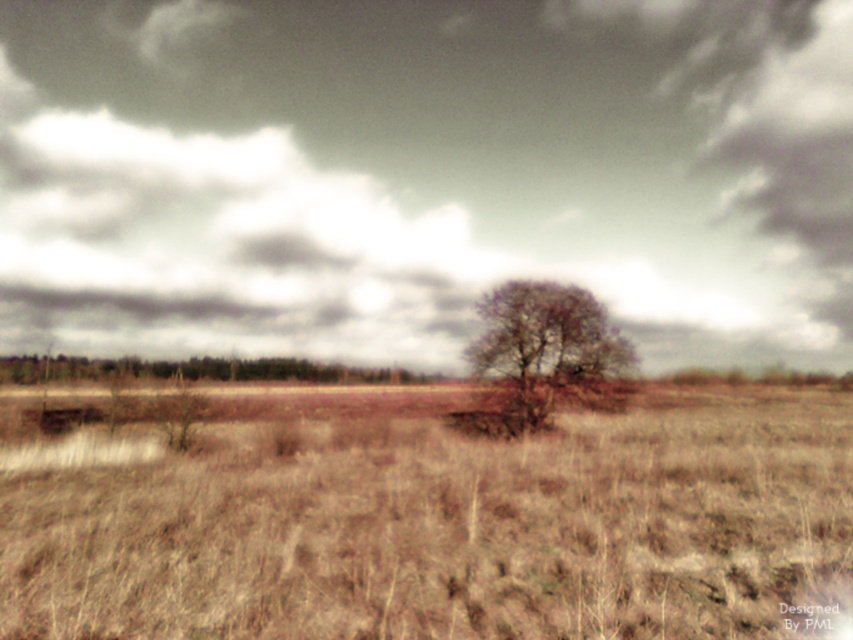
Who is more distant from viewer, [589,76] or [546,413]?

Point [589,76]

Does brown textured tree at center have a lesser width compared to bare branches at center?

In fact, brown textured tree at center might be wider than bare branches at center.

Does point (662, 72) come in front of point (538, 344)?

No, (662, 72) is behind (538, 344).

Where is `brown textured tree at center`? brown textured tree at center is located at coordinates [424, 173].

Does brown dry grass at center have a lesser height compared to brown matte tree at center?

Yes.

In the scene shown: Who is positioned more to the left, brown dry grass at center or brown matte tree at center?

brown matte tree at center is more to the left.

Is point (73, 477) positioned in front of point (15, 365)?

Yes, point (73, 477) is in front of point (15, 365).

The height and width of the screenshot is (640, 853). Identify the location of brown dry grass at center. (428, 516).

Which is below, brown dry grass at center or bare branches at center?

Positioned lower is brown dry grass at center.

Is point (596, 595) positioned before point (508, 417)?

Yes, point (596, 595) is in front of point (508, 417).

This screenshot has width=853, height=640. I want to click on brown dry grass at center, so click(x=428, y=516).